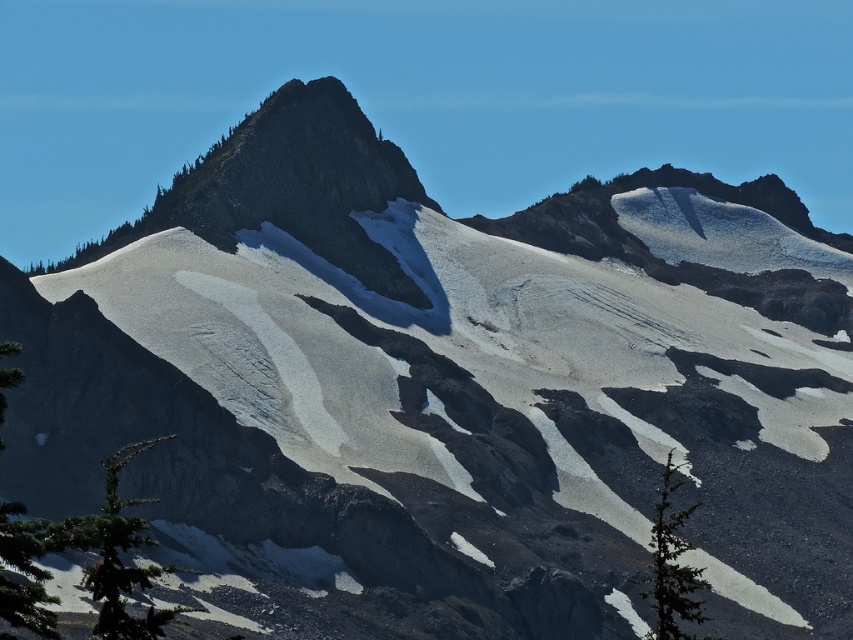
Question: Does green textured pine tree at lower left have a greater width compared to green matte tree at lower right?

Choices:
 (A) no
 (B) yes

Answer: (B)

Question: Does green textured pine tree at lower left have a lesser width compared to green matte tree at lower right?

Choices:
 (A) no
 (B) yes

Answer: (A)

Question: Can you confirm if green textured pine tree at lower left is bigger than green matte tree at lower right?

Choices:
 (A) yes
 (B) no

Answer: (B)